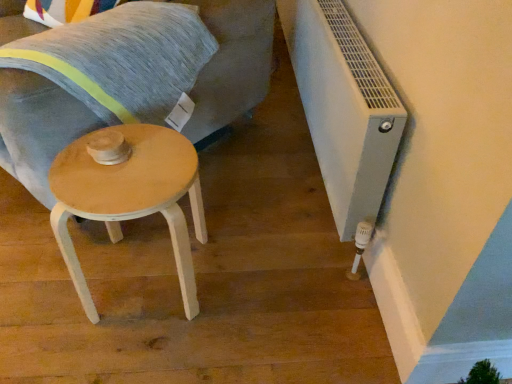
Question: Is light wood swivel chair at center positioned before textured gray pillow at upper left?

Choices:
 (A) yes
 (B) no

Answer: (A)

Question: Are light wood swivel chair at center and textured gray pillow at upper left located far from each other?

Choices:
 (A) yes
 (B) no

Answer: (B)

Question: Are light wood swivel chair at center and textured gray pillow at upper left beside each other?

Choices:
 (A) no
 (B) yes

Answer: (A)

Question: From a real-world perspective, is light wood swivel chair at center positioned under textured gray pillow at upper left based on gravity?

Choices:
 (A) yes
 (B) no

Answer: (A)

Question: From the image's perspective, is light wood swivel chair at center over textured gray pillow at upper left?

Choices:
 (A) yes
 (B) no

Answer: (A)

Question: Based on their sizes in the image, would you say textured gray pillow at upper left is bigger or smaller than white plastic radiator at lower right?

Choices:
 (A) big
 (B) small

Answer: (B)

Question: From a real-world perspective, is textured gray pillow at upper left above or below white plastic radiator at lower right?

Choices:
 (A) above
 (B) below

Answer: (A)

Question: Looking at their shapes, would you say textured gray pillow at upper left is wider or thinner than white plastic radiator at lower right?

Choices:
 (A) thin
 (B) wide

Answer: (B)

Question: Is textured gray pillow at upper left in front of or behind white plastic radiator at lower right in the image?

Choices:
 (A) front
 (B) behind

Answer: (B)

Question: Based on their positions, is light wood swivel chair at center located to the left or right of textured gray pillow at upper left?

Choices:
 (A) left
 (B) right

Answer: (A)

Question: From a real-world perspective, is light wood swivel chair at center physically located above or below textured gray pillow at upper left?

Choices:
 (A) above
 (B) below

Answer: (B)

Question: From the image's perspective, is light wood swivel chair at center located above or below textured gray pillow at upper left?

Choices:
 (A) below
 (B) above

Answer: (B)

Question: Considering the positions of light wood swivel chair at center and textured gray pillow at upper left in the image, is light wood swivel chair at center wider or thinner than textured gray pillow at upper left?

Choices:
 (A) thin
 (B) wide

Answer: (B)

Question: Which is correct: light wood/wooden stool at lower left is inside white plastic radiator at lower right, or outside of it?

Choices:
 (A) inside
 (B) outside

Answer: (B)

Question: Is light wood/wooden stool at lower left taller or shorter than white plastic radiator at lower right?

Choices:
 (A) tall
 (B) short

Answer: (B)